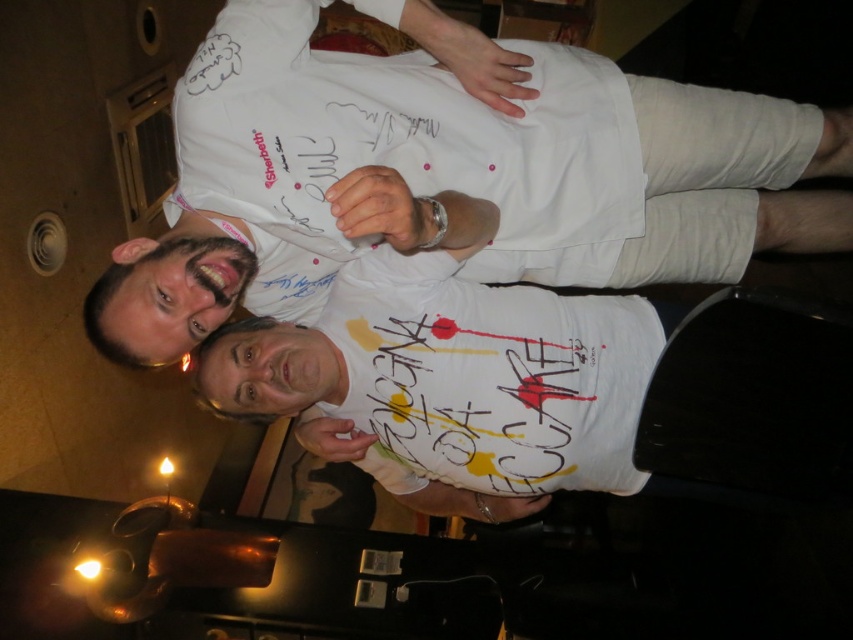
Is point (508, 193) closer to camera compared to point (500, 490)?

Yes.

Is white matte t-shirt at upper center to the right of white matte t-shirt at center from the viewer's perspective?

Yes, white matte t-shirt at upper center is to the right of white matte t-shirt at center.

The height and width of the screenshot is (640, 853). I want to click on white matte t-shirt at upper center, so click(453, 179).

Which is above, white matte t-shirt at upper center or white fabric shirt at center?

white matte t-shirt at upper center is higher up.

This screenshot has height=640, width=853. What are the coordinates of `white matte t-shirt at upper center` in the screenshot? It's located at (453, 179).

At what (x,y) coordinates should I click in order to perform the action: click on white matte t-shirt at upper center. Please return your answer as a coordinate pair (x, y). The height and width of the screenshot is (640, 853). Looking at the image, I should click on [453, 179].

Measure the distance between white matte t-shirt at center and white fabric shirt at center.

white matte t-shirt at center and white fabric shirt at center are 1.28 inches apart from each other.

In the scene shown: Is white matte t-shirt at center positioned behind white fabric shirt at center?

No, it is in front of white fabric shirt at center.

The height and width of the screenshot is (640, 853). What do you see at coordinates (456, 380) in the screenshot?
I see `white matte t-shirt at center` at bounding box center [456, 380].

The image size is (853, 640). I want to click on white matte t-shirt at center, so click(x=456, y=380).